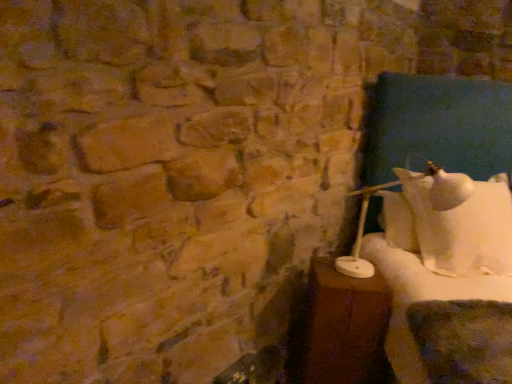
Question: Would you say brown wooden table at right is to the left or to the right of white matte table lamp at right in the picture?

Choices:
 (A) right
 (B) left

Answer: (B)

Question: Does point (359, 369) appear closer or farther from the camera than point (438, 168)?

Choices:
 (A) closer
 (B) farther

Answer: (A)

Question: Is brown wooden table at right taller or shorter than white matte table lamp at right?

Choices:
 (A) short
 (B) tall

Answer: (B)

Question: From the image's perspective, is white matte table lamp at right above or below brown wooden table at right?

Choices:
 (A) below
 (B) above

Answer: (B)

Question: Considering the positions of white matte table lamp at right and brown wooden table at right in the image, is white matte table lamp at right taller or shorter than brown wooden table at right?

Choices:
 (A) tall
 (B) short

Answer: (B)

Question: Is white matte table lamp at right bigger or smaller than brown wooden table at right?

Choices:
 (A) big
 (B) small

Answer: (A)

Question: From a real-world perspective, is white matte table lamp at right positioned above or below brown wooden table at right?

Choices:
 (A) below
 (B) above

Answer: (B)